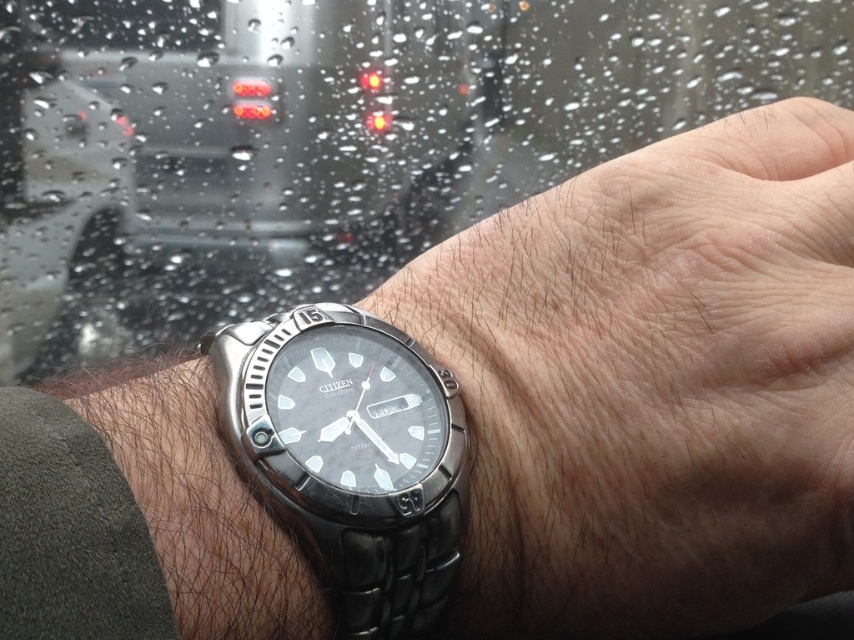
Question: Is satin silver watch at lower left thinner than satin silver watch at center?

Choices:
 (A) yes
 (B) no

Answer: (B)

Question: From the image, what is the correct spatial relationship of metallic wristwatch at center in relation to satin silver watch at lower left?

Choices:
 (A) left
 (B) right

Answer: (B)

Question: Which object appears farthest from the camera in this image?

Choices:
 (A) satin silver watch at lower left
 (B) metallic wristwatch at center
 (C) satin silver watch at center

Answer: (A)

Question: Among these points, which one is nearest to the camera?

Choices:
 (A) (56, 33)
 (B) (729, 433)
 (C) (282, 509)

Answer: (C)

Question: Which point is farther from the camera taking this photo?

Choices:
 (A) (349, 422)
 (B) (92, 264)

Answer: (B)

Question: Is satin silver watch at lower left above satin silver watch at center?

Choices:
 (A) no
 (B) yes

Answer: (B)